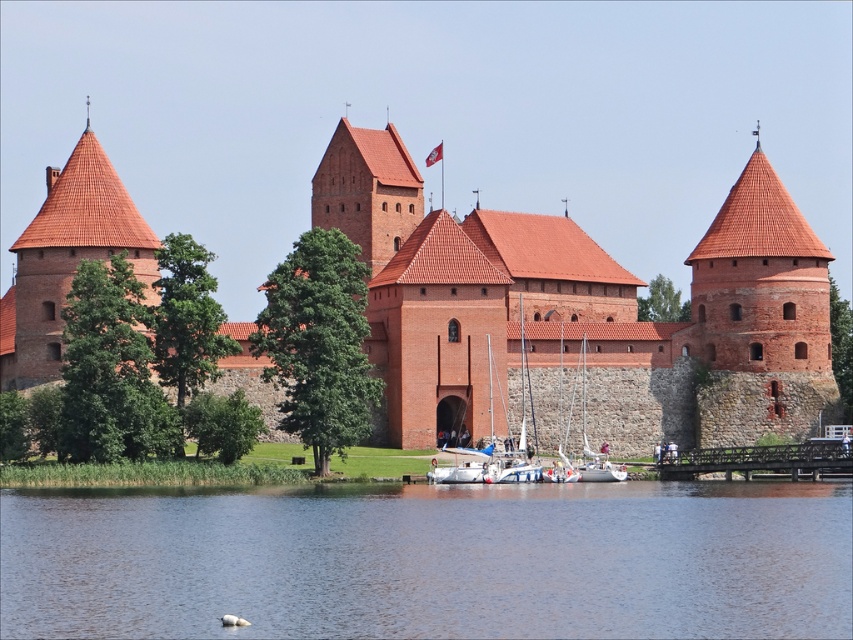
Question: Which object is farther from the camera taking this photo?

Choices:
 (A) transparent water at lower center
 (B) white sailboat at center
 (C) brick tower at left

Answer: (C)

Question: Does red brick castle at center appear on the right side of white sailboat at center?

Choices:
 (A) yes
 (B) no

Answer: (A)

Question: Can you confirm if transparent water at lower center is thinner than brick tower at left?

Choices:
 (A) no
 (B) yes

Answer: (A)

Question: Which point is closer to the camera?

Choices:
 (A) brick tower at left
 (B) transparent water at lower center

Answer: (B)

Question: Is red brick castle at center thinner than brick tower at center?

Choices:
 (A) no
 (B) yes

Answer: (A)

Question: Among these objects, which one is farthest from the camera?

Choices:
 (A) brick tower at center
 (B) white sailboat at center
 (C) red brick castle at center
 (D) transparent water at lower center

Answer: (A)